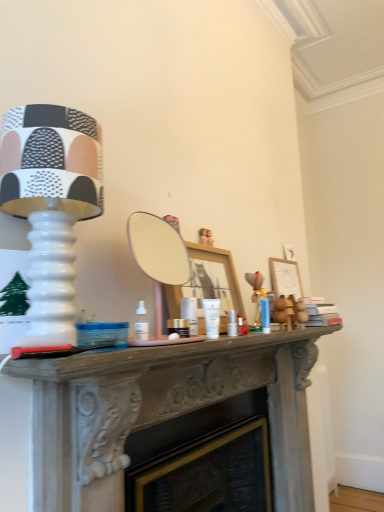
Question: Considering the relative sizes of wooden picture frame at right and matte white lamp at left in the image provided, is wooden picture frame at right taller than matte white lamp at left?

Choices:
 (A) no
 (B) yes

Answer: (A)

Question: Is wooden picture frame at right to the left of matte white lamp at left from the viewer's perspective?

Choices:
 (A) no
 (B) yes

Answer: (A)

Question: Does wooden picture frame at right have a greater width compared to matte white lamp at left?

Choices:
 (A) no
 (B) yes

Answer: (A)

Question: Is wooden picture frame at right smaller than matte white lamp at left?

Choices:
 (A) yes
 (B) no

Answer: (A)

Question: Could you tell me if wooden picture frame at right is turned towards matte white lamp at left?

Choices:
 (A) yes
 (B) no

Answer: (B)

Question: Considering the relative positions of wooden picture frame at right and matte white lamp at left in the image provided, is wooden picture frame at right to the right of matte white lamp at left from the viewer's perspective?

Choices:
 (A) no
 (B) yes

Answer: (B)

Question: Is white glossy cream at center smaller than smooth gray mantelpiece at center?

Choices:
 (A) no
 (B) yes

Answer: (B)

Question: Does white glossy cream at center come behind smooth gray mantelpiece at center?

Choices:
 (A) no
 (B) yes

Answer: (B)

Question: Can you confirm if white glossy cream at center is taller than smooth gray mantelpiece at center?

Choices:
 (A) yes
 (B) no

Answer: (B)

Question: Would you say white glossy cream at center contains smooth gray mantelpiece at center?

Choices:
 (A) no
 (B) yes

Answer: (A)

Question: From the image's perspective, is white glossy cream at center on top of smooth gray mantelpiece at center?

Choices:
 (A) yes
 (B) no

Answer: (A)

Question: Is white glossy cream at center not inside smooth gray mantelpiece at center?

Choices:
 (A) yes
 (B) no

Answer: (A)

Question: Can you see white glossy cream at center touching matte white lamp at left?

Choices:
 (A) no
 (B) yes

Answer: (A)